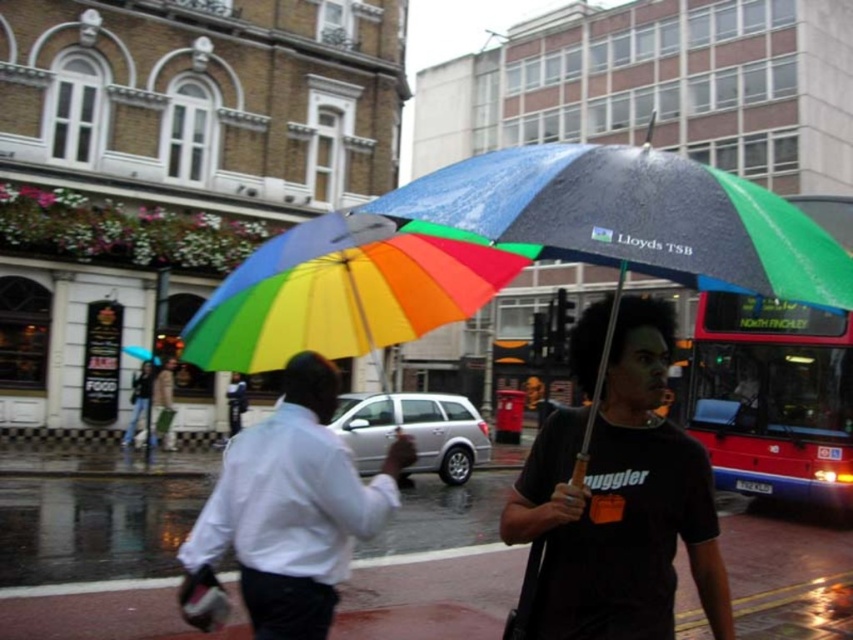
Question: Which point is farther from the camera taking this photo?

Choices:
 (A) (265, 465)
 (B) (558, 230)
 (C) (442, 509)

Answer: (C)

Question: Among these objects, which one is farthest from the camera?

Choices:
 (A) matte black t-shirt at center
 (B) shiny asphalt pavement at lower center
 (C) white shirt at center

Answer: (B)

Question: Can you confirm if rainbow fabric umbrella at center is smaller than matte black t-shirt at center?

Choices:
 (A) no
 (B) yes

Answer: (A)

Question: Is shiny asphalt pavement at lower center above white shirt at center?

Choices:
 (A) no
 (B) yes

Answer: (A)

Question: Is rainbow fabric umbrella at center in front of matte black t-shirt at center?

Choices:
 (A) yes
 (B) no

Answer: (A)

Question: Which is farther from the white shirt at center?

Choices:
 (A) shiny asphalt pavement at lower center
 (B) rainbow fabric umbrella at center
 (C) red metallic bus at right

Answer: (C)